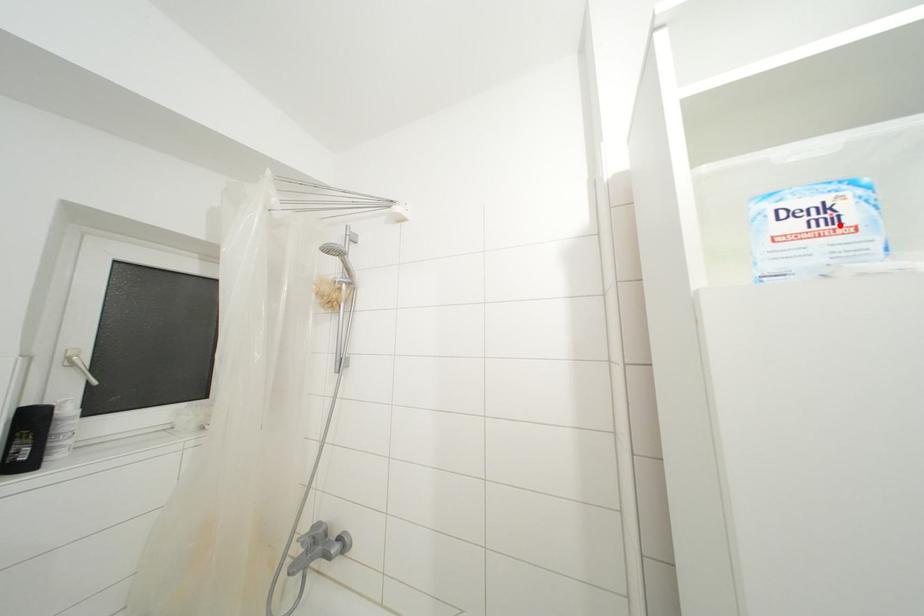
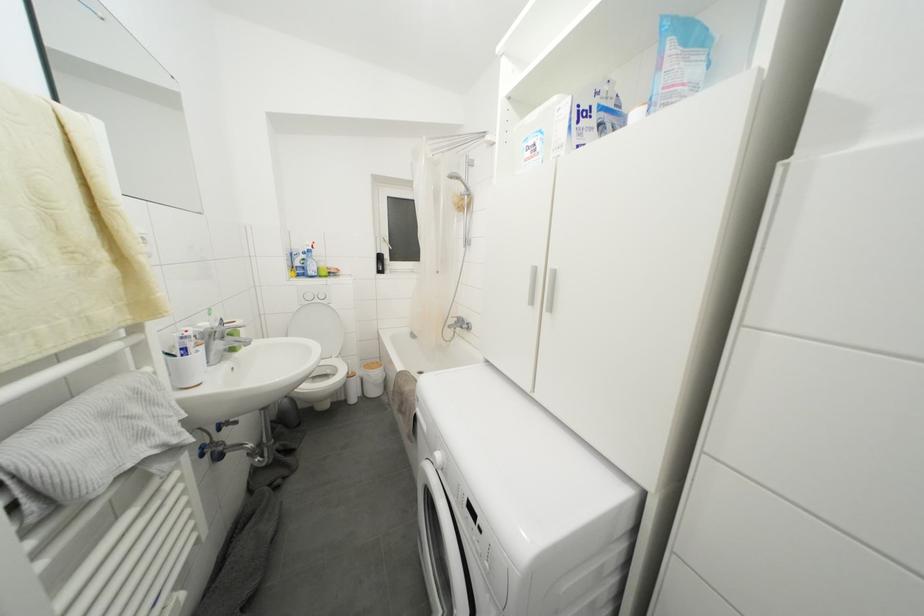
The point at the highlighted location is marked in the first image. Where is the corresponding point in the second image?

(540, 155)